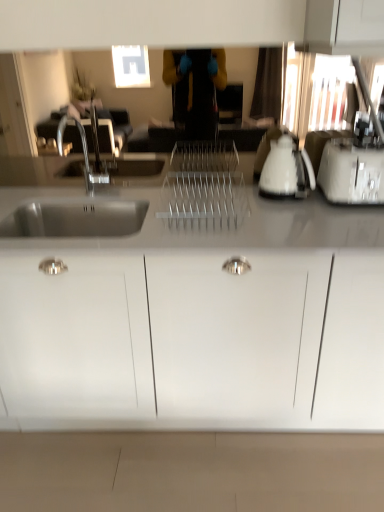
Locate an element on the screen. This screenshot has width=384, height=512. white glossy electric kettle at right is located at coordinates (283, 165).

Image resolution: width=384 pixels, height=512 pixels. Describe the element at coordinates (283, 165) in the screenshot. I see `white glossy electric kettle at right` at that location.

Find the location of a particular element. The height and width of the screenshot is (512, 384). white matte cabinet at center is located at coordinates (193, 340).

The height and width of the screenshot is (512, 384). What are the coordinates of `white plastic toaster at right` in the screenshot? It's located at (351, 172).

Image resolution: width=384 pixels, height=512 pixels. Describe the element at coordinates (351, 172) in the screenshot. I see `white plastic toaster at right` at that location.

The image size is (384, 512). In order to click on white glossy electric kettle at right in this screenshot , I will do `click(283, 165)`.

Is white matte cabinet at center in front of or behind white plastic toaster at right in the image?

white matte cabinet at center is in front of white plastic toaster at right.

Does white matte cabinet at center have a greater height compared to white plastic toaster at right?

Indeed, white matte cabinet at center has a greater height compared to white plastic toaster at right.

Looking at this image, what's the angular difference between white matte cabinet at center and white plastic toaster at right's facing directions?

0.000199 degrees.

Considering the points (347, 369) and (339, 156), which point is in front, point (347, 369) or point (339, 156)?

The point (347, 369) is closer to the camera.

From a real-world perspective, who is located lower, white plastic toaster at right or white matte cabinet at center?

white matte cabinet at center is physically lower.

The height and width of the screenshot is (512, 384). Identify the location of toaster that appears above the white matte cabinet at center (from the image's perspective). (351, 172).

From the image's perspective, is white plastic toaster at right located above or below white matte cabinet at center?

Based on their image positions, white plastic toaster at right is located above white matte cabinet at center.

From the image's perspective, who appears lower, white glossy electric kettle at right or white plastic toaster at right?

From the image's view, white plastic toaster at right is below.

Which of these two, white glossy electric kettle at right or white plastic toaster at right, is thinner?

white glossy electric kettle at right is thinner.

At what (x,y) coordinates should I click in order to perform the action: click on appliance lying on the left of white plastic toaster at right. Please return your answer as a coordinate pair (x, y). Looking at the image, I should click on (283, 165).

Considering their positions, is white matte cabinet at center located in front of or behind white glossy electric kettle at right?

In the image, white matte cabinet at center appears in front of white glossy electric kettle at right.

From the picture: In the image, is white matte cabinet at center on the left side or the right side of white glossy electric kettle at right?

white matte cabinet at center is to the left of white glossy electric kettle at right.

Is white matte cabinet at center turned away from white glossy electric kettle at right?

white matte cabinet at center is not turned away from white glossy electric kettle at right.

Does point (367, 197) come behind point (277, 143)?

No, (367, 197) is closer to viewer.

Is white plastic toaster at right taller or shorter than white glossy electric kettle at right?

In the image, white plastic toaster at right appears to be shorter than white glossy electric kettle at right.

Is white plastic toaster at right smaller than white glossy electric kettle at right?

No, white plastic toaster at right is not smaller than white glossy electric kettle at right.

The height and width of the screenshot is (512, 384). I want to click on appliance behind the white matte cabinet at center, so click(283, 165).

Considering the relative sizes of white glossy electric kettle at right and white matte cabinet at center in the image provided, is white glossy electric kettle at right shorter than white matte cabinet at center?

Yes.

Between point (287, 170) and point (58, 410), which one is positioned behind?

The point (58, 410) is farther from the camera.

How different are the orientations of white glossy electric kettle at right and white matte cabinet at center in degrees?

white glossy electric kettle at right and white matte cabinet at center are facing 1.24 degrees away from each other.

Image resolution: width=384 pixels, height=512 pixels. I want to click on toaster on the right of the white matte cabinet at center, so click(351, 172).

Identify the location of cabinetry lying in front of the white plastic toaster at right. (193, 340).

Which object lies further to the anchor point white glossy electric kettle at right, white matte cabinet at center or white plastic toaster at right?

white matte cabinet at center lies further to white glossy electric kettle at right than the other object.

Which object lies nearer to the anchor point white plastic toaster at right, white matte cabinet at center or white glossy electric kettle at right?

The object closer to white plastic toaster at right is white glossy electric kettle at right.

Estimate the real-world distances between objects in this image. Which object is closer to white matte cabinet at center, white glossy electric kettle at right or white plastic toaster at right?

white glossy electric kettle at right.

When comparing their distances from white matte cabinet at center, does white plastic toaster at right or white glossy electric kettle at right seem closer?

white glossy electric kettle at right.

Looking at this image, estimate the real-world distances between objects in this image. Which object is further from white glossy electric kettle at right, white plastic toaster at right or white matte cabinet at center?

white matte cabinet at center is further to white glossy electric kettle at right.

Estimate the real-world distances between objects in this image. Which object is further from white plastic toaster at right, white glossy electric kettle at right or white matte cabinet at center?

white matte cabinet at center is positioned further to the anchor white plastic toaster at right.

Identify the location of appliance located between white matte cabinet at center and white plastic toaster at right in the left-right direction. The image size is (384, 512). (283, 165).